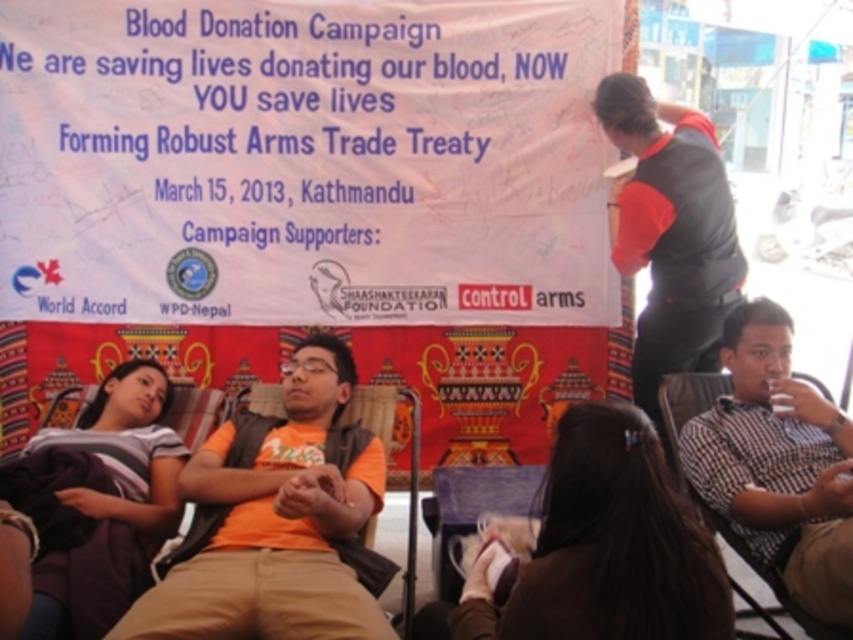
Where is the orange fabric shirt at center located in the image?

The orange fabric shirt at center is located at point (276, 524) in the image.

You are a photographer at the blood donation event in Kathmandu. You need to arrange two participants for a group photo. The orange fabric shirt at center and the gray cotton shirt at lower left are currently positioned in the scene. To ensure they are both visible in the photo, which participant should be moved to the right side?

The gray cotton shirt at lower left should be moved to the right side because the orange fabric shirt at center is already positioned to its right. Moving the gray cotton shirt at lower left to the right would align them properly for visibility.